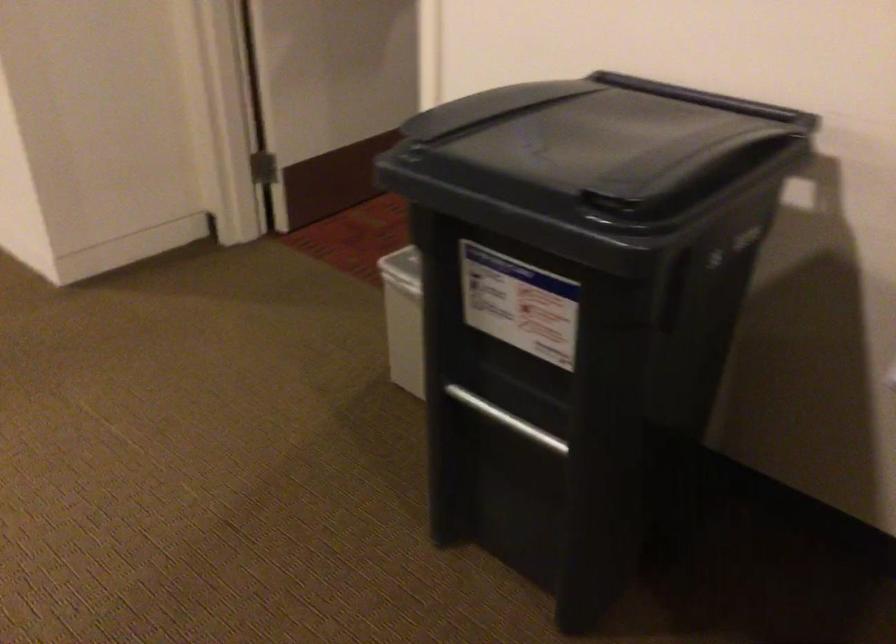
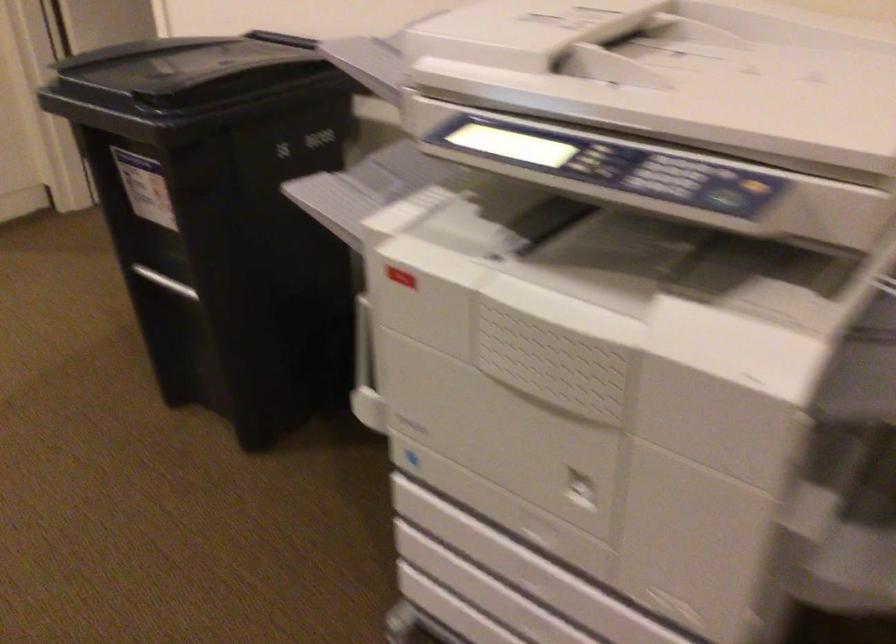
Locate, in the second image, the point that corresponds to [506,420] in the first image.

(165, 281)